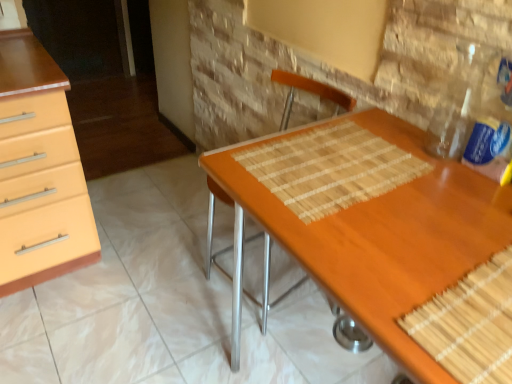
Locate an element on the screen. Image resolution: width=512 pixels, height=384 pixels. blank area beneath bamboo placemat at center (from a real-world perspective) is located at coordinates (332, 166).